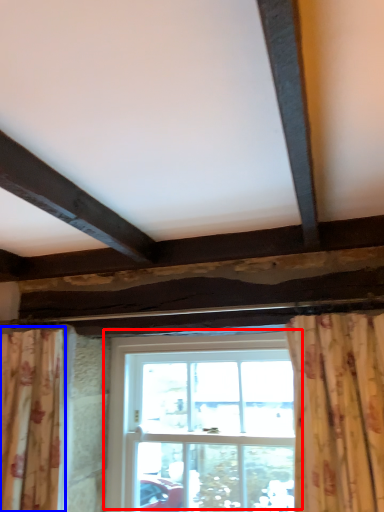
Question: Which object is closer to the camera taking this photo, window (highlighted by a red box) or curtain (highlighted by a blue box)?

Choices:
 (A) window
 (B) curtain

Answer: (B)